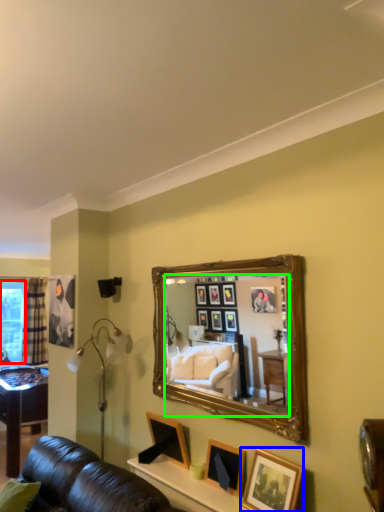
Question: Which is nearer to the window screen (highlighted by a red box)? picture frame (highlighted by a blue box) or mirror (highlighted by a green box).

Choices:
 (A) picture frame
 (B) mirror

Answer: (B)